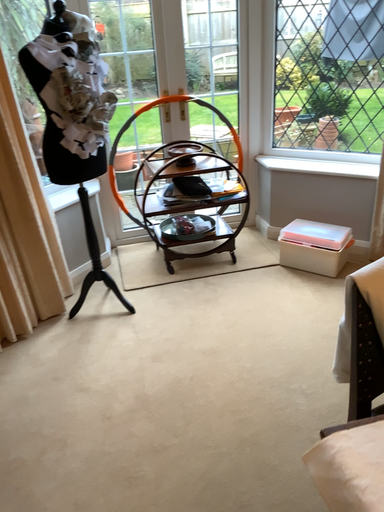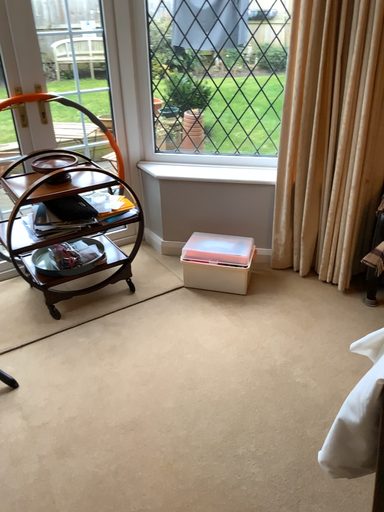
Question: Which way did the camera rotate in the video?

Choices:
 (A) rotated right
 (B) rotated left

Answer: (A)